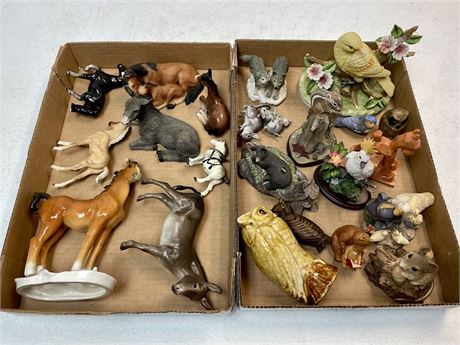
I want to click on boxes, so click(215, 214), click(247, 196).